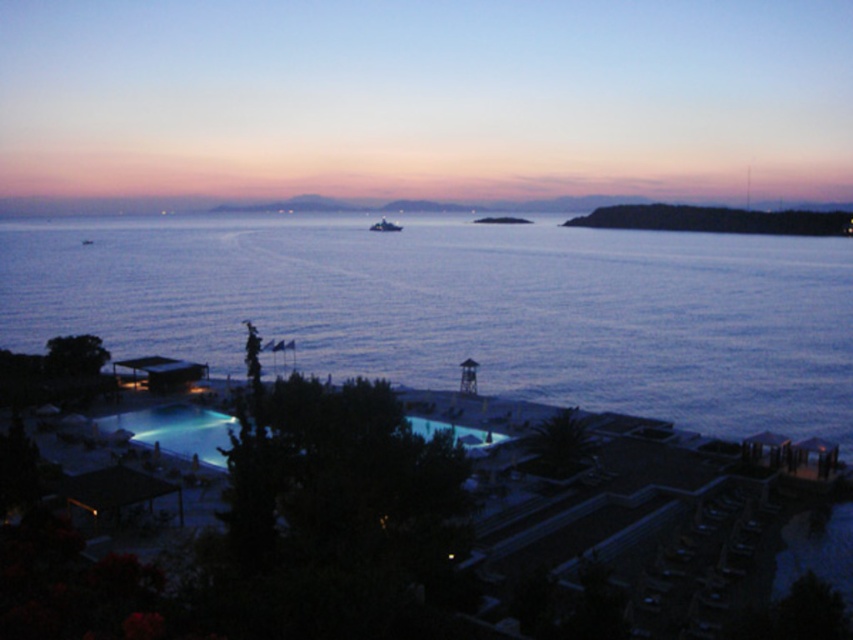
You are a guest staying at the resort and want to take a swim. The blue water at center and the illuminated glass pool at center are both available. Which one is bigger in size?

The blue water at center has a larger size compared to the illuminated glass pool at center, so the blue water at center is bigger.

You are a guest staying at the resort and want to take a photo of the illuminated glass pool at center and the matte black building at lower left. Which object will appear larger in your photo?

The illuminated glass pool at center will appear larger in the photo because it is taller than the matte black building at lower left.

You are a guest staying at the resort and want to take a swim. You see the blue water at center and the illuminated glass pool at center. Which one is above the other?

→ The blue water at center is positioned over the illuminated glass pool at center.